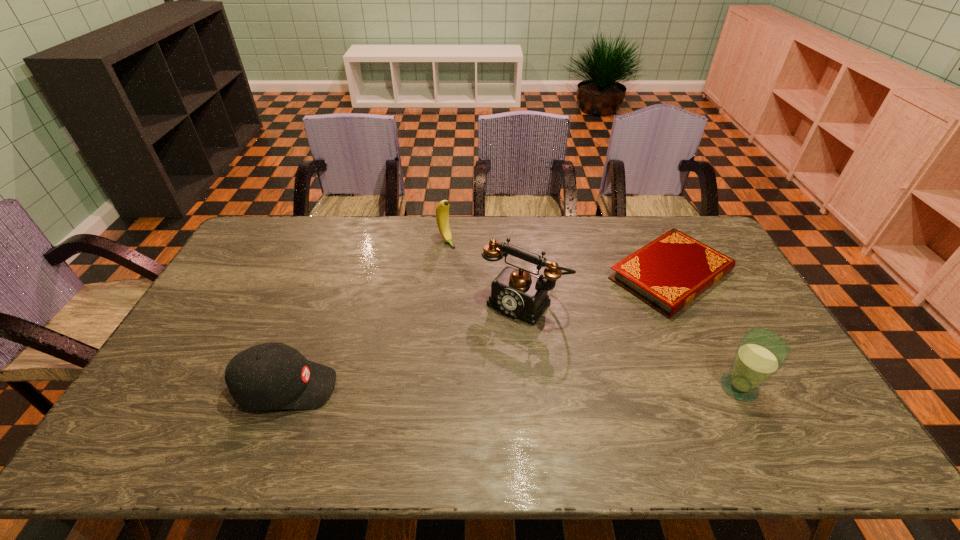
I want to click on empty space between the telephone and the shortest object, so click(x=597, y=289).

Locate an element on the screen. The width and height of the screenshot is (960, 540). vacant area between the shortest object and the glass is located at coordinates (705, 331).

Where is `unoccupied area between the hardback book and the banana`? unoccupied area between the hardback book and the banana is located at coordinates 558,258.

Where is `empty location between the fourth tallest object and the glass`? empty location between the fourth tallest object and the glass is located at coordinates (513, 388).

Locate an element on the screen. empty space that is in between the tallest object and the shortest object is located at coordinates 597,289.

Where is `vacant region between the banana and the glass`? The height and width of the screenshot is (540, 960). vacant region between the banana and the glass is located at coordinates (592, 314).

Identify the location of unoccupied area between the baseball cap and the tallest object. This screenshot has height=540, width=960. (405, 346).

Where is `empty space between the banana and the glass`? empty space between the banana and the glass is located at coordinates (592, 314).

The image size is (960, 540). I want to click on free space between the leftmost object and the fourth object from right to left, so click(x=367, y=314).

Select which object appears as the third closest to the second object from left to right. Please provide its 2D coordinates. Your answer should be formatted as a tuple, i.e. [(x, y)], where the tuple contains the x and y coordinates of a point satisfying the conditions above.

[(273, 375)]